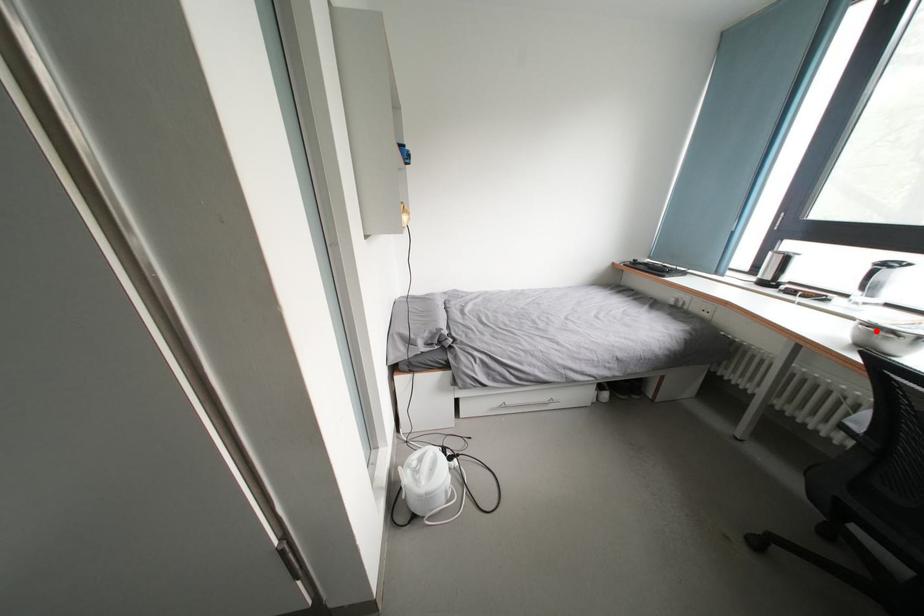
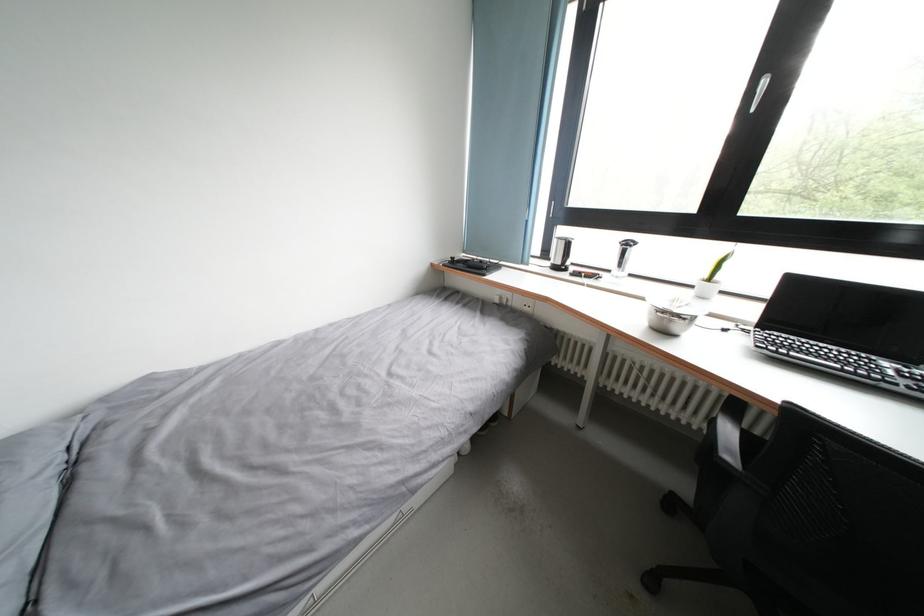
In the second image, find the point that corresponds to the highlighted location in the first image.

(670, 317)